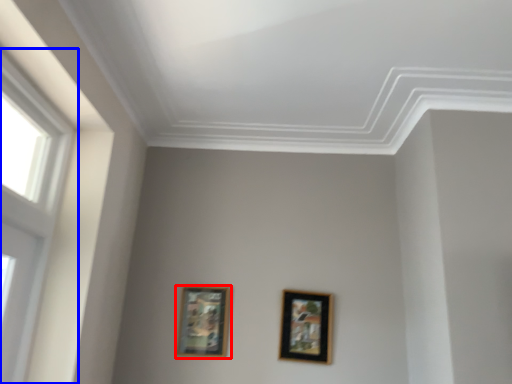
Question: Which of the following is the farthest to the observer, picture frame (highlighted by a red box) or window (highlighted by a blue box)?

Choices:
 (A) picture frame
 (B) window

Answer: (A)